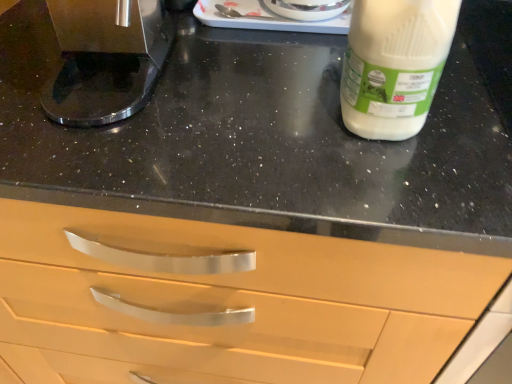
This screenshot has width=512, height=384. What do you see at coordinates (105, 59) in the screenshot?
I see `shiny metallic coffee machine at left` at bounding box center [105, 59].

The image size is (512, 384). Identify the location of shiny metallic coffee machine at left. 105,59.

Locate an element on the screen. Image resolution: width=512 pixels, height=384 pixels. white plastic bottle at upper right is located at coordinates (396, 64).

This screenshot has height=384, width=512. Describe the element at coordinates (396, 64) in the screenshot. I see `white plastic bottle at upper right` at that location.

Where is `shiny metallic coffee machine at left`? The height and width of the screenshot is (384, 512). shiny metallic coffee machine at left is located at coordinates (105, 59).

Visually, is shiny metallic coffee machine at left positioned to the left or to the right of white plastic bottle at upper right?

Clearly, shiny metallic coffee machine at left is on the left of white plastic bottle at upper right in the image.

Consider the image. Which object is more forward, shiny metallic coffee machine at left or white plastic bottle at upper right?

white plastic bottle at upper right.

Is point (60, 26) positioned before point (378, 62)?

No, it is behind (378, 62).

From the image's perspective, is shiny metallic coffee machine at left on white plastic bottle at upper right?

Indeed, from the image's perspective, shiny metallic coffee machine at left is shown above white plastic bottle at upper right.

From a real-world perspective, relative to white plastic bottle at upper right, is shiny metallic coffee machine at left vertically above or below?

From a real-world perspective, shiny metallic coffee machine at left is physically below white plastic bottle at upper right.

Is shiny metallic coffee machine at left thinner than white plastic bottle at upper right?

A: No, shiny metallic coffee machine at left is not thinner than white plastic bottle at upper right.

Between shiny metallic coffee machine at left and white plastic bottle at upper right, which one has less height?

Standing shorter between the two is shiny metallic coffee machine at left.

Who is smaller, shiny metallic coffee machine at left or white plastic bottle at upper right?

With smaller size is white plastic bottle at upper right.

Is shiny metallic coffee machine at left positioned beyond the bounds of white plastic bottle at upper right?

Yes, shiny metallic coffee machine at left is located beyond the bounds of white plastic bottle at upper right.

Is shiny metallic coffee machine at left with white plastic bottle at upper right?

No, shiny metallic coffee machine at left is not making contact with white plastic bottle at upper right.

Is shiny metallic coffee machine at left oriented away from white plastic bottle at upper right?

shiny metallic coffee machine at left is not turned away from white plastic bottle at upper right.

In the scene shown: What's the angular difference between shiny metallic coffee machine at left and white plastic bottle at upper right's facing directions?

The facing directions of shiny metallic coffee machine at left and white plastic bottle at upper right are 5.74 degrees apart.

In the image, there is a shiny metallic coffee machine at left. Where is `yoghurt below it (from the image's perspective)`? yoghurt below it (from the image's perspective) is located at coordinates (396, 64).

In the image, is white plastic bottle at upper right on the left side or the right side of shiny metallic coffee machine at left?

Clearly, white plastic bottle at upper right is on the right of shiny metallic coffee machine at left in the image.

In the image, is white plastic bottle at upper right positioned in front of or behind shiny metallic coffee machine at left?

Visually, white plastic bottle at upper right is located in front of shiny metallic coffee machine at left.

Is point (345, 113) positioned in front of point (65, 29)?

Yes, it is in front of point (65, 29).

From the image's perspective, relative to shiny metallic coffee machine at left, is white plastic bottle at upper right above or below?

Based on their image positions, white plastic bottle at upper right is located beneath shiny metallic coffee machine at left.

From a real-world perspective, is white plastic bottle at upper right physically above shiny metallic coffee machine at left?

Yes, from a real-world perspective, white plastic bottle at upper right is on top of shiny metallic coffee machine at left.

Considering the relative sizes of white plastic bottle at upper right and shiny metallic coffee machine at left in the image provided, is white plastic bottle at upper right thinner than shiny metallic coffee machine at left?

Correct, the width of white plastic bottle at upper right is less than that of shiny metallic coffee machine at left.

Between white plastic bottle at upper right and shiny metallic coffee machine at left, which one has more height?

white plastic bottle at upper right is taller.

Between white plastic bottle at upper right and shiny metallic coffee machine at left, which one has smaller size?

With smaller size is white plastic bottle at upper right.

Is shiny metallic coffee machine at left located within white plastic bottle at upper right?

No, shiny metallic coffee machine at left is not inside white plastic bottle at upper right.

Is white plastic bottle at upper right far away from shiny metallic coffee machine at left?

Actually, white plastic bottle at upper right and shiny metallic coffee machine at left are a little close together.

Is white plastic bottle at upper right oriented towards shiny metallic coffee machine at left?

No, white plastic bottle at upper right is not facing towards shiny metallic coffee machine at left.

In the image, there is a white plastic bottle at upper right. At what (x,y) coordinates should I click in order to perform the action: click on coffee machine above it (from the image's perspective). Please return your answer as a coordinate pair (x, y). Image resolution: width=512 pixels, height=384 pixels. Looking at the image, I should click on (105, 59).

What are the coordinates of `coffee machine that is under the white plastic bottle at upper right (from a real-world perspective)` in the screenshot? It's located at (105, 59).

Find the location of a particular element. The width and height of the screenshot is (512, 384). coffee machine above the white plastic bottle at upper right (from the image's perspective) is located at coordinates (105, 59).